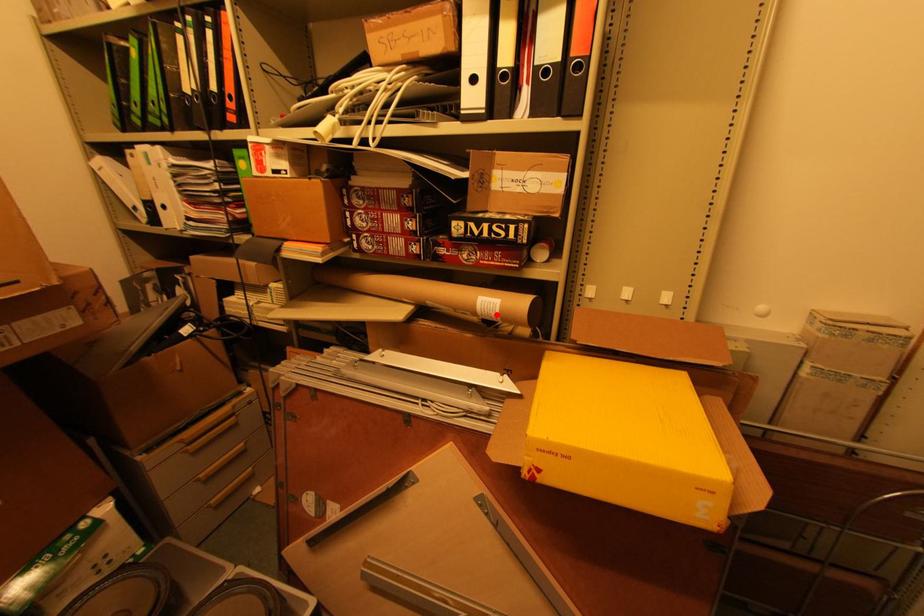
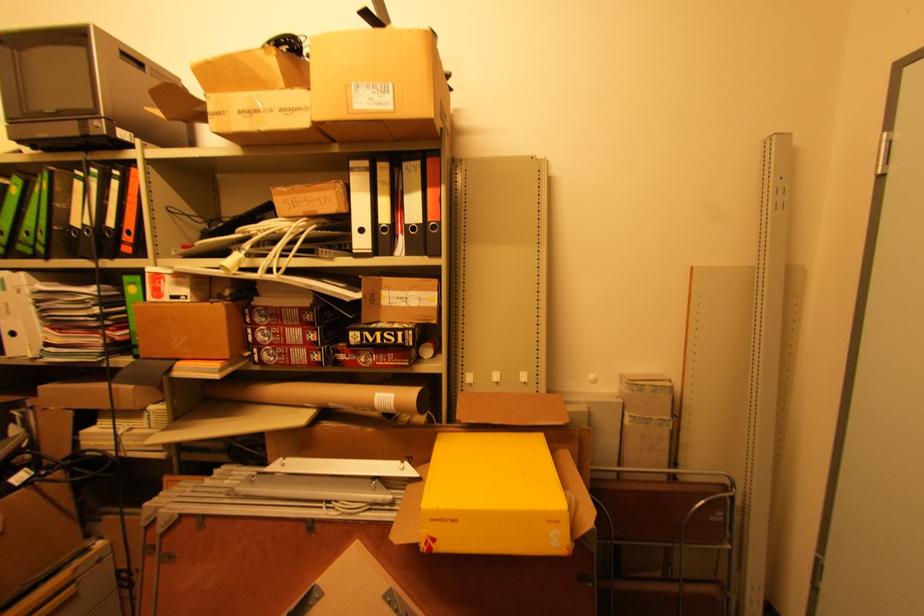
Where in the second image is the point corresponding to the highlighted location from the first image?

(392, 408)